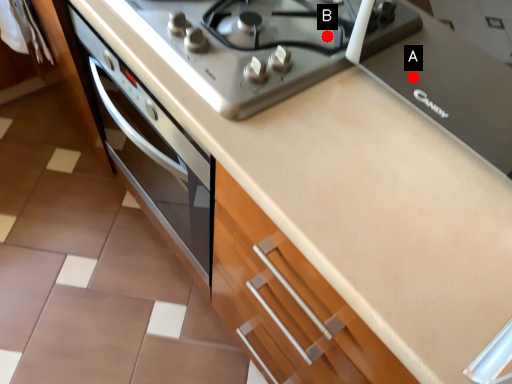
Question: Two points are circled on the image, labeled by A and B beside each circle. Which point is further to the camera?

Choices:
 (A) A is further
 (B) B is further

Answer: (B)